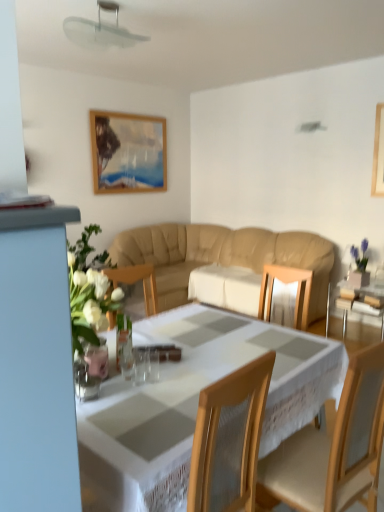
This screenshot has height=512, width=384. I want to click on free location in front of clear glass vase at lower left, so click(99, 417).